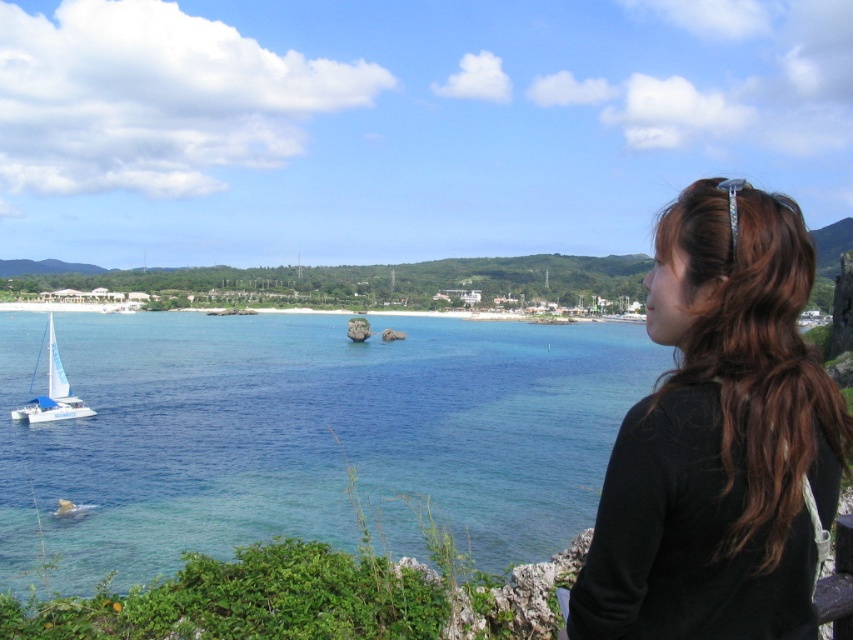
You are a photographer trying to capture the woman with brown hair at upper right and the white sailboat at lower left in the same frame. Based on their positions, which object is closer to the right edge of the photo?

The brown hair at upper right is to the right of the white sailboat at lower left, so the brown hair at upper right is closer to the right edge of the photo.

You are a photographer planning to take a photo of the clear blue water at center and the white sailboat at lower left. Based on their sizes in the image, which object would appear larger in the final photo?

The clear blue water at center appears larger because it is taller than the white sailboat at lower left.

You are a photographer planning to take a photo of the clear blue water at center and the white sailboat at lower left. Based on their positions, which object should you focus on first to ensure both are in the frame?

The white sailboat at lower left should be focused on first because the clear blue water at center is above it, so adjusting the frame to include the lower positioned boat will naturally include the water above it.